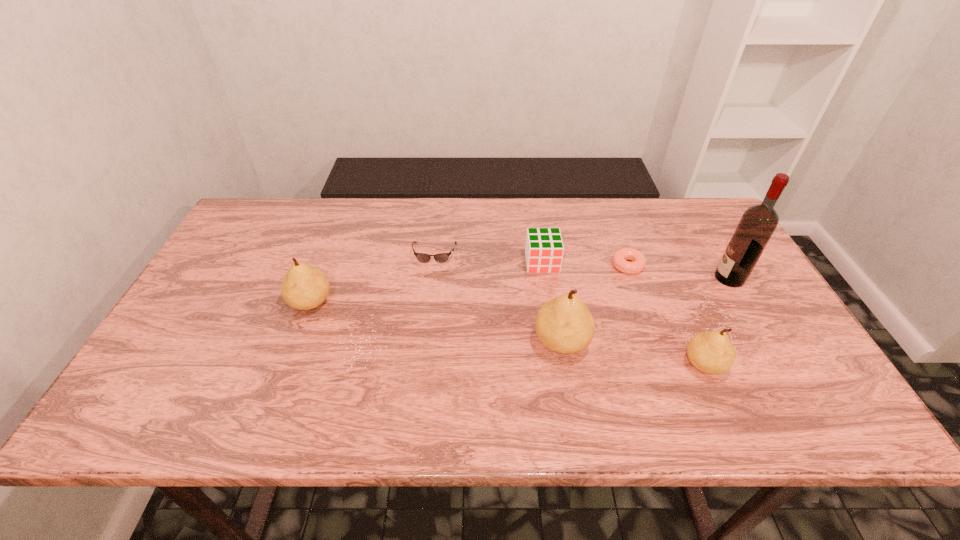
The height and width of the screenshot is (540, 960). Identify the location of pear that is the second nearest to the fifth tallest object. (711, 352).

The height and width of the screenshot is (540, 960). What are the coordinates of `pear that is the third closest to the sixth tallest object` in the screenshot? It's located at (711, 352).

Where is `free space that satisfies the following two spatial constraints: 1. on the red face of the cube; 2. on the left side of the shortest object`? free space that satisfies the following two spatial constraints: 1. on the red face of the cube; 2. on the left side of the shortest object is located at coordinates (542, 266).

Locate an element on the screen. The height and width of the screenshot is (540, 960). free spot that satisfies the following two spatial constraints: 1. on the front-facing side of the second pear from right to left; 2. on the right side of the sunglasses is located at coordinates (424, 342).

At what (x,y) coordinates should I click in order to perform the action: click on free space that satisfies the following two spatial constraints: 1. on the back side of the shortest object; 2. on the right side of the leftmost object. Please return your answer as a coordinate pair (x, y). Looking at the image, I should click on (324, 266).